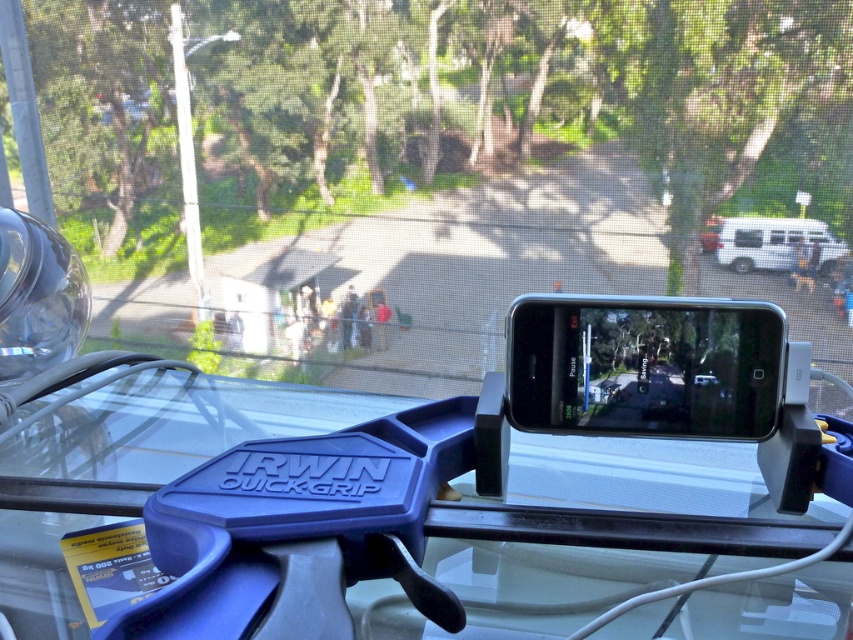
You are a delivery person who just arrived at the location and need to place a package on the table. The package is 20 inches long. Can you place the package on the table without it hanging off the edge? Please consider the blue plastic clamp at center as an obstacle.

The blue plastic clamp at center is 19.94 inches from the camera, so the package which is 20 inches long may not fit without hanging off the edge since the clamp is very close to the edge.

You are sitting at the glass table and want to pick up the black glossy phone at center. Which direction should you move your hand to reach it from the blue plastic clamp at center?

The blue plastic clamp at center is to the left of the black glossy phone at center, so you should move your hand to the right to reach the black glossy phone at center from the blue plastic clamp at center.